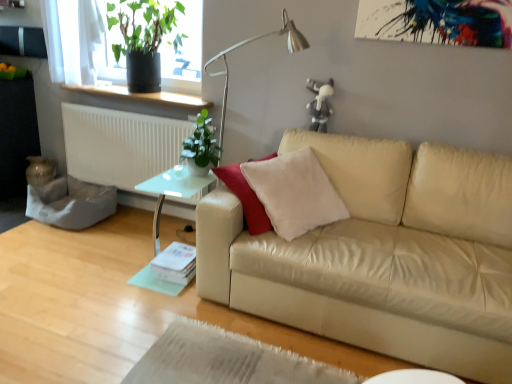
Question: Considering the positions of beige leather couch at center and white plastic radiator at left in the image, is beige leather couch at center taller or shorter than white plastic radiator at left?

Choices:
 (A) short
 (B) tall

Answer: (B)

Question: Considering their positions, is beige leather couch at center located in front of or behind white plastic radiator at left?

Choices:
 (A) front
 (B) behind

Answer: (A)

Question: Which object is the farthest from the green glossy plant at upper left, acting as the second houseplant starting from the top?

Choices:
 (A) metallic silver table lamp at upper center
 (B) beige leather couch at center
 (C) transparent glass table at lower left
 (D) white plastic radiator at left
 (E) green matte plant at upper left, placed as the 1th houseplant when sorted from top to bottom

Answer: (B)

Question: Which is nearer to the beige leather couch at center?

Choices:
 (A) white plastic radiator at left
 (B) metallic silver table lamp at upper center
 (C) transparent glass table at lower left
 (D) green matte plant at upper left, arranged as the second houseplant when viewed from the right
 (E) green glossy plant at upper left, arranged as the 1th houseplant when viewed from the front

Answer: (C)